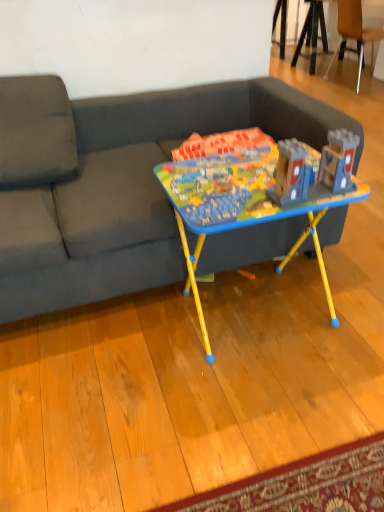
I want to click on dark gray fabric couch at center, so click(x=131, y=191).

Image resolution: width=384 pixels, height=512 pixels. Describe the element at coordinates (250, 193) in the screenshot. I see `matte plastic table at center` at that location.

Locate an element on the screen. Image resolution: width=384 pixels, height=512 pixels. wooden at upper right is located at coordinates [354, 34].

I want to click on dark gray fabric couch at center, so click(x=131, y=191).

Is matte plastic table at center to the right of wooden at upper right from the viewer's perspective?

No, matte plastic table at center is not to the right of wooden at upper right.

Is matte plastic table at center further to camera compared to wooden at upper right?

No.

At what (x,y) coordinates should I click in order to perform the action: click on chair located behind the matte plastic table at center. Please return your answer as a coordinate pair (x, y). Looking at the image, I should click on (354, 34).

Can you confirm if matte plastic table at center is taller than wooden at upper right?

No.

Is matte plastic table at center completely or partially inside wooden at upper right?

Actually, matte plastic table at center is outside wooden at upper right.

Who is taller, wooden at upper right or matte plastic table at center?

wooden at upper right is taller.

Is wooden at upper right bigger than matte plastic table at center?

Correct, wooden at upper right is larger in size than matte plastic table at center.

Is matte plastic table at center thinner than dark gray fabric couch at center?

Yes.

In the scene shown: Does matte plastic table at center have a lesser height compared to dark gray fabric couch at center?

Correct, matte plastic table at center is not as tall as dark gray fabric couch at center.

Are matte plastic table at center and dark gray fabric couch at center located far from each other?

No, matte plastic table at center is not far from dark gray fabric couch at center.

Looking at this image, who is smaller, matte plastic table at center or dark gray fabric couch at center?

Smaller between the two is matte plastic table at center.

Looking at this image, does dark gray fabric couch at center have a greater height compared to matte plastic table at center?

Indeed, dark gray fabric couch at center has a greater height compared to matte plastic table at center.

Based on the photo, is dark gray fabric couch at center further to camera compared to matte plastic table at center?

No, dark gray fabric couch at center is closer to the viewer.

Is point (87, 128) closer or farther from the camera than point (207, 170)?

Clearly, point (87, 128) is more distant from the camera than point (207, 170).

Is dark gray fabric couch at center touching matte plastic table at center?

No, dark gray fabric couch at center is not making contact with matte plastic table at center.

Is wooden at upper right positioned beyond the bounds of dark gray fabric couch at center?

wooden at upper right lies outside dark gray fabric couch at center's area.

From the image's perspective, is wooden at upper right above or below dark gray fabric couch at center?

Clearly, from the image's perspective, wooden at upper right is above dark gray fabric couch at center.

Can you see wooden at upper right touching dark gray fabric couch at center?

No, wooden at upper right is not making contact with dark gray fabric couch at center.

Does wooden at upper right have a lesser width compared to dark gray fabric couch at center?

Indeed, wooden at upper right has a lesser width compared to dark gray fabric couch at center.

Considering the sizes of objects dark gray fabric couch at center and wooden at upper right in the image provided, who is thinner, dark gray fabric couch at center or wooden at upper right?

With smaller width is wooden at upper right.

From a real-world perspective, is dark gray fabric couch at center positioned under wooden at upper right based on gravity?

No.

Locate an element on the screen. The height and width of the screenshot is (512, 384). table below the wooden at upper right (from the image's perspective) is located at coordinates (250, 193).

Locate an element on the screen. chair to the right of matte plastic table at center is located at coordinates (x=354, y=34).

Looking at this image, from the image, which object appears to be farther from matte plastic table at center, dark gray fabric couch at center or wooden at upper right?

wooden at upper right is positioned further to the anchor matte plastic table at center.

Considering their positions, is dark gray fabric couch at center positioned further to wooden at upper right than matte plastic table at center?

Based on the image, matte plastic table at center appears to be further to wooden at upper right.

When comparing their distances from dark gray fabric couch at center, does matte plastic table at center or wooden at upper right seem further?

wooden at upper right is further to dark gray fabric couch at center.

Estimate the real-world distances between objects in this image. Which object is closer to dark gray fabric couch at center, wooden at upper right or matte plastic table at center?

matte plastic table at center is positioned closer to the anchor dark gray fabric couch at center.

Which object lies further to the anchor point matte plastic table at center, wooden at upper right or dark gray fabric couch at center?

The object further to matte plastic table at center is wooden at upper right.

Estimate the real-world distances between objects in this image. Which object is closer to wooden at upper right, matte plastic table at center or dark gray fabric couch at center?

dark gray fabric couch at center is positioned closer to the anchor wooden at upper right.

At what (x,y) coordinates should I click in order to perform the action: click on table between dark gray fabric couch at center and wooden at upper right from front to back. Please return your answer as a coordinate pair (x, y). Image resolution: width=384 pixels, height=512 pixels. Looking at the image, I should click on (250, 193).